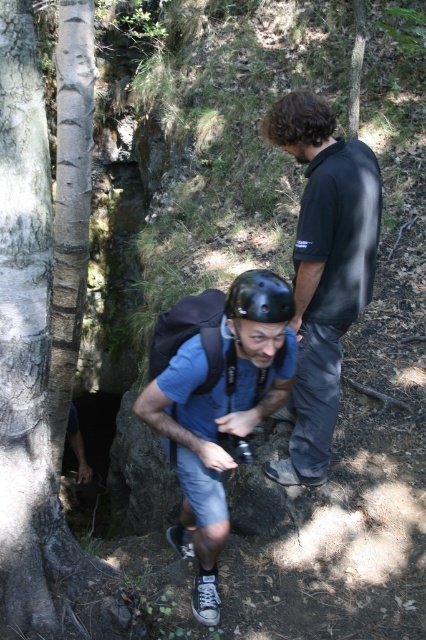
You are a photographer trying to capture a photo of both individuals in the scene. The first person is at point (58, 547) and the second person is at point (167, 396). Which point is closer to the camera to ensure they are in focus?

Point (58, 547) is closer to the camera than point (167, 396), so focusing on that point will ensure the first person is in focus.

You are a photographer trying to capture both the blue fabric helmet at center and the black matte helmet at center in a single frame. Based on their positions, which helmet should you focus on first to ensure both are in the shot?

The blue fabric helmet at center is to the left of black matte helmet at center, so you should focus on the blue fabric helmet at center first to ensure both are in the shot.